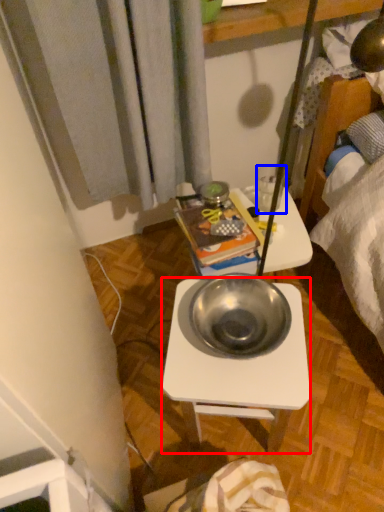
Question: Which object appears closest to the camera in this image, desk (highlighted by a red box) or coffee cup (highlighted by a blue box)?

Choices:
 (A) desk
 (B) coffee cup

Answer: (A)